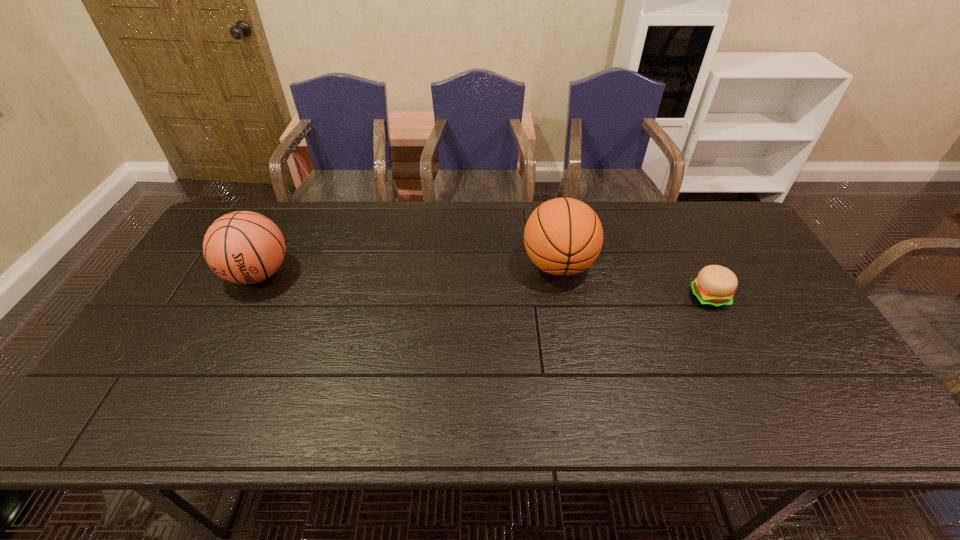
You are a GUI agent. You are given a task and a screenshot of the screen. Output one action in this format:
    pyautogui.click(x=<x>, y=<y>)
    Task: Click on the free spot at the near edge of the desktop
    
    Given the screenshot: What is the action you would take?
    pyautogui.click(x=476, y=423)

In the image, there is a desktop. What are the coordinates of `free region at the left edge` in the screenshot? It's located at (170, 387).

This screenshot has height=540, width=960. Find the location of `vacant space at the right edge of the desktop`. vacant space at the right edge of the desktop is located at coordinates (766, 321).

Image resolution: width=960 pixels, height=540 pixels. I want to click on vacant space at the near left corner of the desktop, so click(96, 431).

Find the location of a particular element. This screenshot has width=960, height=540. free space at the far right corner is located at coordinates (703, 235).

The height and width of the screenshot is (540, 960). Identify the location of vacant region between the leftmost object and the right basketball. (408, 269).

Where is `empty space that is in between the left basketball and the hamburger`? empty space that is in between the left basketball and the hamburger is located at coordinates (484, 285).

The width and height of the screenshot is (960, 540). In order to click on free space between the right basketball and the leftmost object in this screenshot , I will do `click(408, 269)`.

Image resolution: width=960 pixels, height=540 pixels. I want to click on free space between the leftmost object and the second object from left to right, so click(x=408, y=269).

Locate an element on the screen. This screenshot has width=960, height=540. vacant area that lies between the left basketball and the rightmost object is located at coordinates (484, 285).